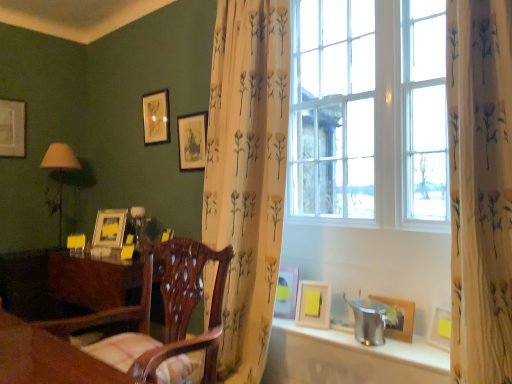
Locate an element on the screen. This screenshot has width=512, height=384. matte white picture frame at upper right, acting as the second picture frame starting from the front is located at coordinates click(x=313, y=304).

What do you see at coordinates (348, 358) in the screenshot? This screenshot has width=512, height=384. I see `metallic silver bucket at lower right` at bounding box center [348, 358].

This screenshot has width=512, height=384. What do you see at coordinates (286, 293) in the screenshot?
I see `matte white picture frame at center, the fifth picture frame in the back-to-front sequence` at bounding box center [286, 293].

Where is `matte wooden picture frame at upper center, arranged as the fourth picture frame when viewed from the back`? The width and height of the screenshot is (512, 384). matte wooden picture frame at upper center, arranged as the fourth picture frame when viewed from the back is located at coordinates (192, 141).

Is matte wooden picture frame at upper center, arranged as the fourth picture frame when viewed from the back, next to matte white picture frame at upper right, acting as the second picture frame starting from the front?

No, matte wooden picture frame at upper center, arranged as the fourth picture frame when viewed from the back, is not beside matte white picture frame at upper right, acting as the second picture frame starting from the front.

Which point is more distant from viewer, [192,137] or [320,303]?

The point [192,137] is more distant.

From the image's perspective, would you say matte wooden picture frame at upper center, the fourth picture frame positioned from the front, is shown under matte white picture frame at upper right, the 6th picture frame when ordered from left to right?

No.

Could you tell me if matte wooden picture frame at upper center, the fourth picture frame positioned from the front, is facing matte white picture frame at upper right, the 6th picture frame when ordered from left to right?

No, matte wooden picture frame at upper center, the fourth picture frame positioned from the front, is not facing towards matte white picture frame at upper right, the 6th picture frame when ordered from left to right.

Considering the relative sizes of matte beige lamp at left and transparent glass window at center in the image provided, is matte beige lamp at left wider than transparent glass window at center?

Correct, the width of matte beige lamp at left exceeds that of transparent glass window at center.

From a real-world perspective, is matte beige lamp at left physically located above or below transparent glass window at center?

matte beige lamp at left is below transparent glass window at center.

From their relative heights in the image, would you say matte beige lamp at left is taller or shorter than transparent glass window at center?

In the image, matte beige lamp at left appears to be shorter than transparent glass window at center.

Between wooden picture frame at lower right, which ranks as the 1th picture frame in right-to-left order, and matte white picture frame at upper right, which is the sixth picture frame in back-to-front order, which one is positioned in front?

Positioned in front is wooden picture frame at lower right, which ranks as the 1th picture frame in right-to-left order.

What's the angular difference between wooden picture frame at lower right, which ranks as the 1th picture frame in right-to-left order, and matte white picture frame at upper right, arranged as the second picture frame when viewed from the right,'s facing directions?

19.6 degrees.

From the picture: From the image's perspective, does wooden picture frame at lower right, marked as the 7th picture frame in a left-to-right arrangement, appear lower than matte white picture frame at upper right, arranged as the second picture frame when viewed from the right?

Yes.

Which is more to the left, wooden picture frame at lower right, the 1th picture frame when ordered from front to back, or matte white picture frame at upper right, arranged as the second picture frame when viewed from the right?

Positioned to the left is matte white picture frame at upper right, arranged as the second picture frame when viewed from the right.

Is point (205, 127) positioned after point (8, 103)?

No, (205, 127) is in front of (8, 103).

Are matte wooden picture frame at upper center, the fourth picture frame in the right-to-left sequence, and matte silver picture frame at upper left, marked as the first picture frame in a back-to-front arrangement, far apart?

That's right, there is a large distance between matte wooden picture frame at upper center, the fourth picture frame in the right-to-left sequence, and matte silver picture frame at upper left, marked as the first picture frame in a back-to-front arrangement.

From the image's perspective, is matte wooden picture frame at upper center, the fourth picture frame in the right-to-left sequence, under matte silver picture frame at upper left, marked as the 1th picture frame in a left-to-right arrangement?

Indeed, from the image's perspective, matte wooden picture frame at upper center, the fourth picture frame in the right-to-left sequence, is shown beneath matte silver picture frame at upper left, marked as the 1th picture frame in a left-to-right arrangement.

How far apart are wooden chair at center and matte white picture frame at upper right, acting as the second picture frame starting from the front?

wooden chair at center and matte white picture frame at upper right, acting as the second picture frame starting from the front, are 30.55 inches apart from each other.

How many degrees apart are the facing directions of wooden chair at center and matte white picture frame at upper right, acting as the second picture frame starting from the front?

16.9 degrees.

Is point (188, 284) closer or farther from the camera than point (298, 306)?

Point (188, 284).

Based on the photo, can you see wooden chair at center touching matte white picture frame at upper right, the 6th picture frame when ordered from left to right?

No, wooden chair at center is not with matte white picture frame at upper right, the 6th picture frame when ordered from left to right.

From a real-world perspective, is matte white picture frame at center, which appears as the third picture frame when viewed from the front, under matte wooden picture frame at upper center, the fourth picture frame in the right-to-left sequence?

Yes.

Is matte wooden picture frame at upper center, the fourth picture frame in the right-to-left sequence, at the back of matte white picture frame at center, the 3th picture frame positioned from the right?

No, matte wooden picture frame at upper center, the fourth picture frame in the right-to-left sequence, is not at the back of matte white picture frame at center, the 3th picture frame positioned from the right.

Is matte white picture frame at center, which appears as the third picture frame when viewed from the front, bigger than matte wooden picture frame at upper center, arranged as the fourth picture frame when viewed from the back?

Actually, matte white picture frame at center, which appears as the third picture frame when viewed from the front, might be smaller than matte wooden picture frame at upper center, arranged as the fourth picture frame when viewed from the back.

This screenshot has width=512, height=384. There is a matte wooden picture frame at upper center, the fourth picture frame positioned from the front. Find the location of `the 2nd picture frame below it (from the image's perspective)`. the 2nd picture frame below it (from the image's perspective) is located at coordinates (286, 293).

This screenshot has height=384, width=512. In order to click on curtain in front of the matte silver picture frame at upper left, the 7th picture frame from the right in this screenshot , I will do `click(247, 173)`.

Is floral-patterned fabric at center smaller than matte silver picture frame at upper left, which is the 7th picture frame in front-to-back order?

No, floral-patterned fabric at center is not smaller than matte silver picture frame at upper left, which is the 7th picture frame in front-to-back order.

Is point (285, 65) more distant than point (15, 131)?

No, (285, 65) is closer to viewer.

From the image's perspective, is floral-patterned fabric at center beneath matte silver picture frame at upper left, marked as the first picture frame in a back-to-front arrangement?

Yes.

Locate an element on the screen. picture frame that is the 2nd one when counting leftward from the matte white picture frame at upper right, acting as the second picture frame starting from the front is located at coordinates (192, 141).

This screenshot has width=512, height=384. What are the coordinates of `window on the right of the matte beige lamp at left` in the screenshot? It's located at (371, 120).

In the scene shown: When comparing their distances from wooden table at lower left, does floral-patterned fabric at center or wooden chair at center seem closer?

Among the two, wooden chair at center is located nearer to wooden table at lower left.

Based on their spatial positions, is wooden chair at center or metallic silver bucket at lower right closer to matte white picture frame at center, the 5th picture frame viewed from the left?

Based on the image, metallic silver bucket at lower right appears to be nearer to matte white picture frame at center, the 5th picture frame viewed from the left.

Based on the photo, looking at the image, which one is located further to matte silver picture frame at upper left, the 7th picture frame from the right, matte gold picture frame at upper center, arranged as the 3th picture frame when viewed from the left, or wooden table at lower left?

Among the two, wooden table at lower left is located further to matte silver picture frame at upper left, the 7th picture frame from the right.

Looking at the image, which one is located further to metallic silver bucket at lower right, wooden chair at center or matte beige lamp at left?

matte beige lamp at left.

Estimate the real-world distances between objects in this image. Which object is further from floral-patterned fabric at center, matte wooden picture frame at upper center, arranged as the 4th picture frame when viewed from the left, or transparent glass window at center?

transparent glass window at center is further to floral-patterned fabric at center.

From the image, which object appears to be farther from gold metallic picture frame at left, which is the 2th picture frame from left to right, matte white picture frame at center, the fifth picture frame in the back-to-front sequence, or matte silver picture frame at upper left, marked as the first picture frame in a back-to-front arrangement?

Among the two, matte white picture frame at center, the fifth picture frame in the back-to-front sequence, is located further to gold metallic picture frame at left, which is the 2th picture frame from left to right.

Which object lies nearer to the anchor point matte beige lamp at left, matte wooden picture frame at upper center, the fourth picture frame positioned from the front, or wooden picture frame at lower right, which ranks as the 1th picture frame in right-to-left order?

The object closer to matte beige lamp at left is matte wooden picture frame at upper center, the fourth picture frame positioned from the front.

Based on their spatial positions, is matte white picture frame at center, the 3th picture frame positioned from the right, or gold metallic picture frame at left, which is the 2th picture frame from left to right, further from transparent glass window at center?

gold metallic picture frame at left, which is the 2th picture frame from left to right, lies further to transparent glass window at center than the other object.

Locate an element on the screen. This screenshot has height=384, width=512. curtain between matte wooden picture frame at upper center, arranged as the 4th picture frame when viewed from the left, and transparent glass window at center is located at coordinates (247, 173).

You are a GUI agent. You are given a task and a screenshot of the screen. Output one action in this format:
    pyautogui.click(x=<x>, y=<y>)
    Task: Click on the table between matte silver picture frame at upper left, which is the 7th picture frame in front-to-back order, and wooden picture frame at lower right, the 1th picture frame when ordered from front to back, from left to right
    The height and width of the screenshot is (384, 512).
    Given the screenshot: What is the action you would take?
    pyautogui.click(x=47, y=358)

Identify the location of curtain between matte wooden picture frame at upper center, the fourth picture frame in the right-to-left sequence, and matte white picture frame at upper right, arranged as the second picture frame when viewed from the right, from top to bottom. (247, 173).

In order to click on window positioned between wooden table at lower left and matte white picture frame at upper right, which is the sixth picture frame in back-to-front order, from near to far in this screenshot , I will do `click(371, 120)`.